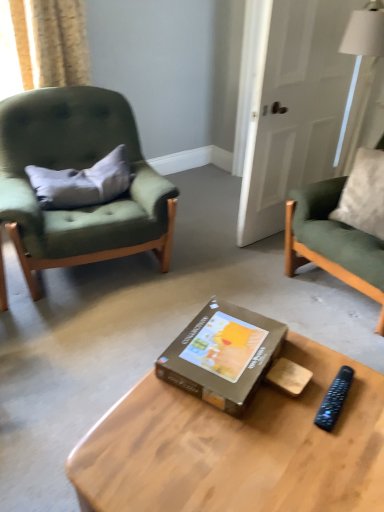
Question: Is brown cardboard box at center placed right next to wooden coffee table at center?

Choices:
 (A) no
 (B) yes

Answer: (A)

Question: Does brown cardboard box at center have a greater width compared to wooden coffee table at center?

Choices:
 (A) yes
 (B) no

Answer: (B)

Question: Is brown cardboard box at center oriented towards wooden coffee table at center?

Choices:
 (A) yes
 (B) no

Answer: (B)

Question: Is brown cardboard box at center not near wooden coffee table at center?

Choices:
 (A) no
 (B) yes

Answer: (A)

Question: From a real-world perspective, is brown cardboard box at center located higher than wooden coffee table at center?

Choices:
 (A) no
 (B) yes

Answer: (B)

Question: Is black plastic remote at lower right situated inside wooden coffee table at center or outside?

Choices:
 (A) inside
 (B) outside

Answer: (B)

Question: Based on their sizes in the image, would you say black plastic remote at lower right is bigger or smaller than wooden coffee table at center?

Choices:
 (A) small
 (B) big

Answer: (A)

Question: In the image, is black plastic remote at lower right positioned in front of or behind wooden coffee table at center?

Choices:
 (A) behind
 (B) front

Answer: (A)

Question: Considering the positions of black plastic remote at lower right and wooden coffee table at center in the image, is black plastic remote at lower right wider or thinner than wooden coffee table at center?

Choices:
 (A) wide
 (B) thin

Answer: (B)

Question: In the image, is gray fabric pillow at left positioned in front of or behind white glossy door at upper right?

Choices:
 (A) behind
 (B) front

Answer: (A)

Question: From a real-world perspective, is gray fabric pillow at left positioned above or below white glossy door at upper right?

Choices:
 (A) above
 (B) below

Answer: (B)

Question: From the image's perspective, is gray fabric pillow at left located above or below white glossy door at upper right?

Choices:
 (A) below
 (B) above

Answer: (A)

Question: From their relative heights in the image, would you say gray fabric pillow at left is taller or shorter than white glossy door at upper right?

Choices:
 (A) short
 (B) tall

Answer: (A)

Question: In the image, is brown cardboard box at center positioned in front of or behind white glossy door at upper right?

Choices:
 (A) front
 (B) behind

Answer: (A)

Question: Is point (183, 350) closer or farther from the camera than point (347, 78)?

Choices:
 (A) closer
 (B) farther

Answer: (A)